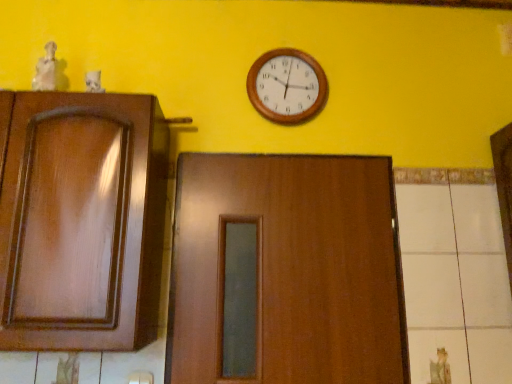
What do you see at coordinates (287, 86) in the screenshot?
I see `wooden wall clock at upper center` at bounding box center [287, 86].

I want to click on wooden wall clock at upper center, so click(287, 86).

At what (x,y) coordinates should I click in order to perform the action: click on wooden wall clock at upper center. Please return your answer as a coordinate pair (x, y). Looking at the image, I should click on (287, 86).